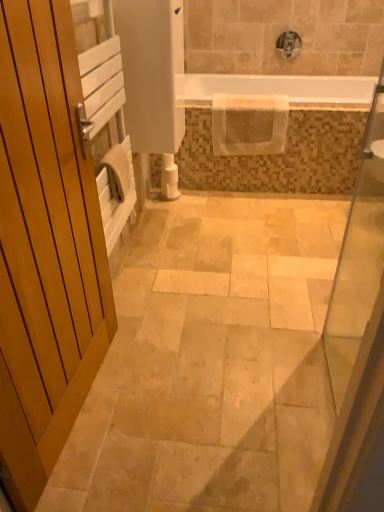
Identify the location of wooden door at left. The width and height of the screenshot is (384, 512). (45, 247).

Locate an element on the screen. satin nickel faucet at upper center is located at coordinates (289, 44).

The width and height of the screenshot is (384, 512). What do you see at coordinates (289, 44) in the screenshot?
I see `satin nickel faucet at upper center` at bounding box center [289, 44].

This screenshot has height=512, width=384. What are the coordinates of `white textured towel at upper center` in the screenshot? It's located at click(278, 90).

Locate an element on the screen. white matte toilet paper at center is located at coordinates (169, 178).

Based on the photo, between transparent glass door at right and white matte toilet paper at center, which one has less height?

With less height is white matte toilet paper at center.

From a real-world perspective, does transparent glass door at right stand above white matte toilet paper at center?

Correct, in the physical world, transparent glass door at right is higher than white matte toilet paper at center.

Is transparent glass door at right facing towards white matte toilet paper at center?

No, transparent glass door at right is not aimed at white matte toilet paper at center.

Can you confirm if satin nickel faucet at upper center is shorter than white matte toilet paper at center?

Indeed, satin nickel faucet at upper center has a lesser height compared to white matte toilet paper at center.

In terms of width, does satin nickel faucet at upper center look wider or thinner when compared to white matte toilet paper at center?

Clearly, satin nickel faucet at upper center has less width compared to white matte toilet paper at center.

In the image, is satin nickel faucet at upper center on the left side or the right side of white matte toilet paper at center?

Based on their positions, satin nickel faucet at upper center is located to the right of white matte toilet paper at center.

Can we say satin nickel faucet at upper center lies outside white matte toilet paper at center?

That's correct, satin nickel faucet at upper center is outside of white matte toilet paper at center.

From their relative heights in the image, would you say wooden door at left is taller or shorter than white textured towel at center?

Clearly, wooden door at left is taller compared to white textured towel at center.

Locate an element on the screen. This screenshot has height=512, width=384. door above the white textured towel at center (from a real-world perspective) is located at coordinates (45, 247).

Considering the positions of objects wooden door at left and white textured towel at center in the image provided, who is behind, wooden door at left or white textured towel at center?

white textured towel at center is behind.

From a real-world perspective, is wooden door at left positioned above or below white textured towel at center?

In terms of real-world spatial position, wooden door at left is above white textured towel at center.

Does transparent glass door at right appear on the right side of wooden door at left?

Yes.

Does point (374, 212) appear closer or farther from the camera than point (55, 20)?

Point (374, 212) is farther from the camera than point (55, 20).

Is wooden door at left inside transparent glass door at right?

That's incorrect, wooden door at left is not inside transparent glass door at right.

Is transparent glass door at right wider or thinner than wooden door at left?

transparent glass door at right is thinner than wooden door at left.

Looking at this image, would you say wooden door at left is outside transparent glass door at right?

Absolutely, wooden door at left is external to transparent glass door at right.

Between wooden door at left and transparent glass door at right, which one has smaller size?

With smaller size is transparent glass door at right.

Considering the relative sizes of wooden door at left and transparent glass door at right in the image provided, is wooden door at left taller than transparent glass door at right?

Yes, wooden door at left is taller than transparent glass door at right.

Based on the photo, which object is thinner, wooden door at left or transparent glass door at right?

transparent glass door at right is thinner.

From the picture: Between satin nickel faucet at upper center and wooden door at left, which one has more height?

With more height is wooden door at left.

Looking at this image, from a real-world perspective, is satin nickel faucet at upper center on wooden door at left?

Correct, in the physical world, satin nickel faucet at upper center is higher than wooden door at left.

Is satin nickel faucet at upper center smaller than wooden door at left?

Correct, satin nickel faucet at upper center occupies less space than wooden door at left.

Between satin nickel faucet at upper center and wooden door at left, which one appears on the right side from the viewer's perspective?

satin nickel faucet at upper center.

Relative to wooden door at left, is white textured towel at upper center in front or behind?

white textured towel at upper center is behind wooden door at left.

Is white textured towel at upper center bigger than wooden door at left?

No, white textured towel at upper center is not bigger than wooden door at left.

Is white textured towel at upper center not within wooden door at left?

white textured towel at upper center is positioned outside wooden door at left.

From the image's perspective, is white textured towel at upper center located above or below wooden door at left?

white textured towel at upper center is above wooden door at left.

You are a GUI agent. You are given a task and a screenshot of the screen. Output one action in this format:
    pyautogui.click(x=<x>, y=<y>)
    Task: Click on the toilet paper beneath the transparent glass door at right (from a real-world perspective)
    The height and width of the screenshot is (512, 384).
    Given the screenshot: What is the action you would take?
    pyautogui.click(x=169, y=178)

You are a GUI agent. You are given a task and a screenshot of the screen. Output one action in this format:
    pyautogui.click(x=<x>, y=<y>)
    Task: Click on the toilet paper in front of the satin nickel faucet at upper center
    This screenshot has height=512, width=384.
    Given the screenshot: What is the action you would take?
    pyautogui.click(x=169, y=178)

Looking at the image, which one is located further to satin nickel faucet at upper center, white matte toilet paper at center or transparent glass door at right?

transparent glass door at right.

From the image, which object appears to be nearer to white textured towel at center, satin nickel faucet at upper center or transparent glass door at right?

Based on the image, satin nickel faucet at upper center appears to be nearer to white textured towel at center.

Based on their spatial positions, is wooden door at left or white textured towel at upper center closer to transparent glass door at right?

wooden door at left.

In the scene shown: Which object lies further to the anchor point white textured towel at upper center, satin nickel faucet at upper center or wooden door at left?

The object further to white textured towel at upper center is wooden door at left.

Considering their positions, is wooden door at left positioned further to white textured towel at upper center than white matte toilet paper at center?

Among the two, wooden door at left is located further to white textured towel at upper center.

Based on the photo, which object lies nearer to the anchor point wooden door at left, white matte toilet paper at center or satin nickel faucet at upper center?

white matte toilet paper at center.

Which object lies further to the anchor point white textured towel at center, satin nickel faucet at upper center or white matte toilet paper at center?

Based on the image, satin nickel faucet at upper center appears to be further to white textured towel at center.

When comparing their distances from transparent glass door at right, does white textured towel at center or white matte toilet paper at center seem closer?

white textured towel at center lies closer to transparent glass door at right than the other object.

Identify the location of glass door between wooden door at left and white textured towel at center in the front-back direction. (358, 255).

I want to click on toilet paper positioned between transparent glass door at right and satin nickel faucet at upper center from near to far, so click(169, 178).

Where is `bathtub between transparent glass door at right and satin nickel faucet at upper center in the front-back direction`? This screenshot has width=384, height=512. bathtub between transparent glass door at right and satin nickel faucet at upper center in the front-back direction is located at coordinates (x=278, y=90).

Locate an element on the screen. The image size is (384, 512). material between satin nickel faucet at upper center and white matte toilet paper at center in the vertical direction is located at coordinates (249, 124).